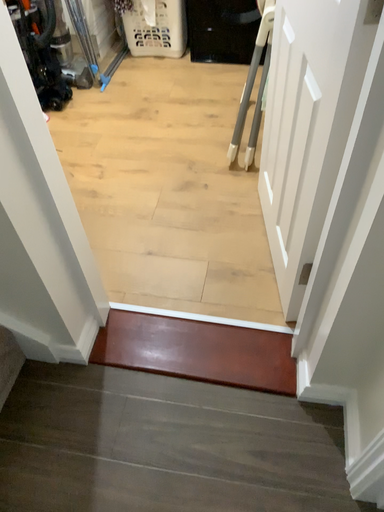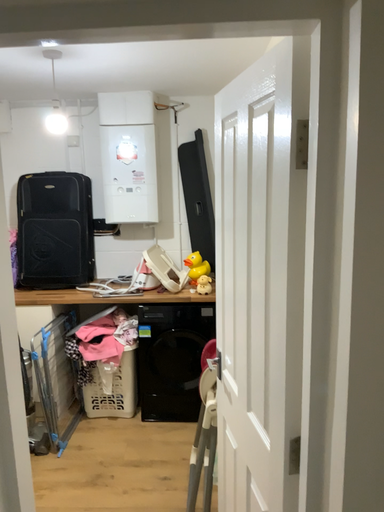
Question: Which way did the camera rotate in the video?

Choices:
 (A) rotated left
 (B) rotated right

Answer: (B)